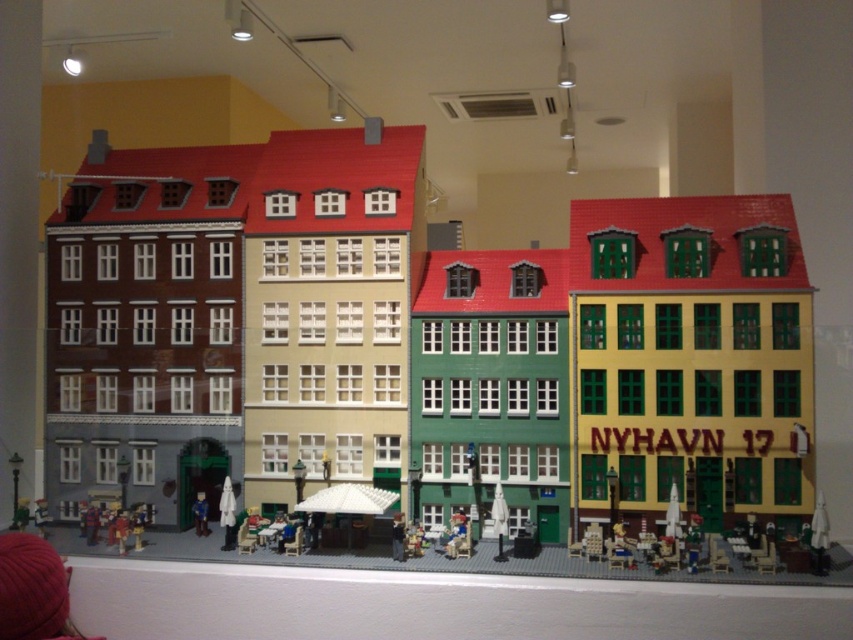
You are standing at the point marked as point (457, 536) in the miniature model of Nyhavn street scene. Looking around, you see the four colorful buildings. Which building is directly behind you?

The point (457, 536) is on the smooth plastic chair at center. Since the buildings are arranged from left to right as red, beige, green, and yellow, the building directly behind the chair would depend on the chair orientation. However, without specific orientation details, we can infer that the central green building is closest to the chair, so the building directly behind might be the green building in the middle.

From the picture: You are a visitor to the miniature model of the Nyhavn street scene. You see a smooth plastic chair at center and a smooth plastic figure at center. Which object is positioned to the east in the model?

The smooth plastic chair at center is positioned to the east of the smooth plastic figure at center.

You are a visitor standing in front of the miniature model of the street scene. You see a smooth plastic chair at center and a smooth plastic figure at center. Which object is taller?

The smooth plastic chair at center is taller than the smooth plastic figure at center.